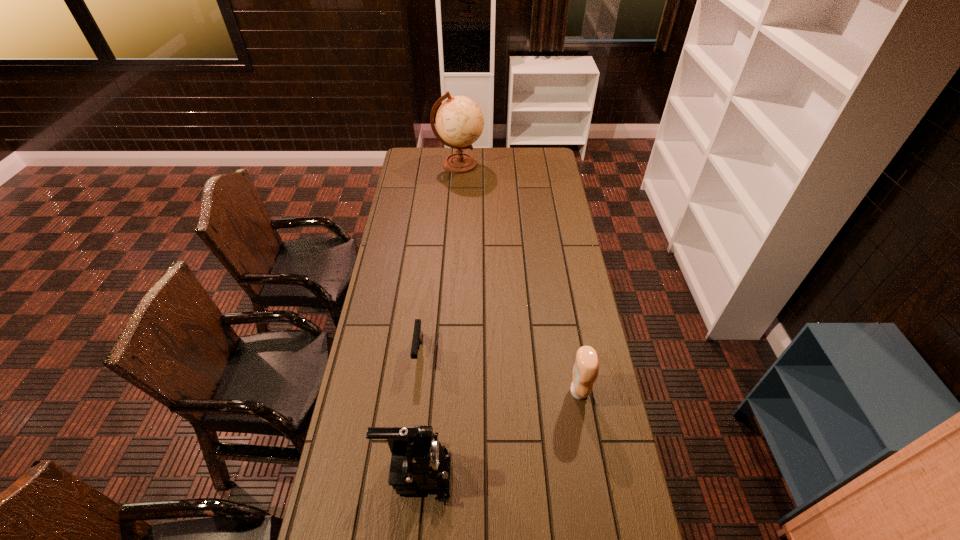
Where is `vacant space located on the label of the second nearest object`? The height and width of the screenshot is (540, 960). vacant space located on the label of the second nearest object is located at coordinates (508, 391).

At what (x,y) coordinates should I click in order to perform the action: click on free space located on the label of the second nearest object. Please return your answer as a coordinate pair (x, y). The height and width of the screenshot is (540, 960). Looking at the image, I should click on (490, 391).

The image size is (960, 540). Identify the location of vacant space located 0.240m on the label of the second nearest object. (498, 391).

The height and width of the screenshot is (540, 960). In order to click on vacant space located 0.280m on the front-facing side of the pistol in this screenshot , I will do `click(407, 451)`.

Where is `object that is at the far edge`? The image size is (960, 540). object that is at the far edge is located at coordinates (459, 120).

Locate an element on the screen. The image size is (960, 540). object at the left edge is located at coordinates (418, 462).

Where is `object located at the right edge`? Image resolution: width=960 pixels, height=540 pixels. object located at the right edge is located at coordinates (586, 368).

Image resolution: width=960 pixels, height=540 pixels. In the image, there is a desktop. In order to click on free space at the far edge in this screenshot , I will do `click(486, 153)`.

Where is `vacant space at the left edge of the desktop`? The height and width of the screenshot is (540, 960). vacant space at the left edge of the desktop is located at coordinates (415, 266).

Identify the location of free space at the right edge of the desktop. This screenshot has height=540, width=960. (577, 480).